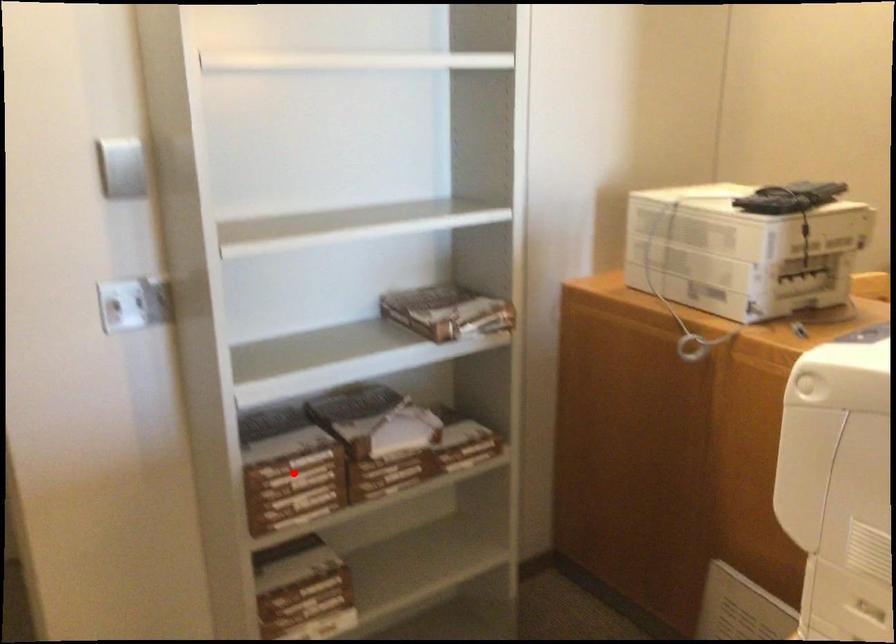
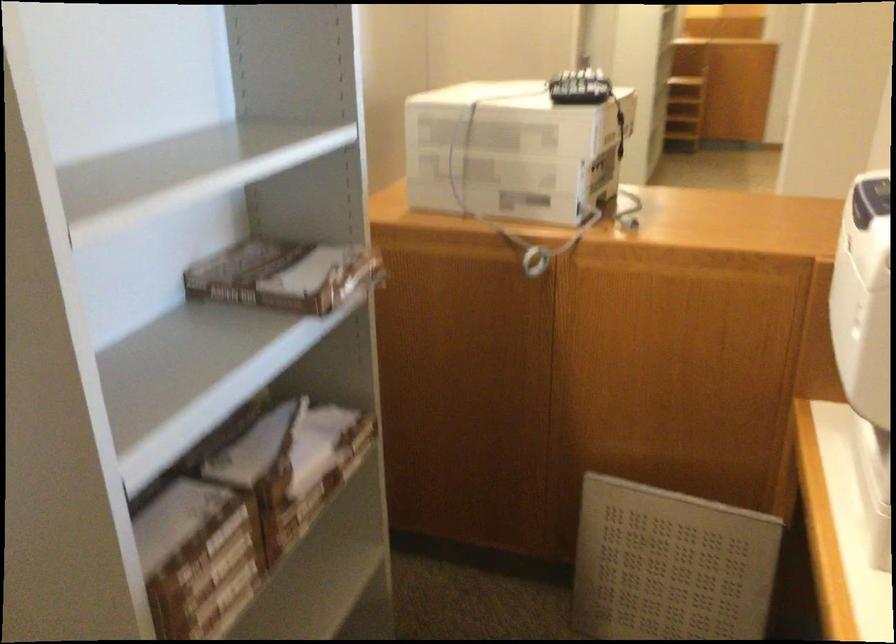
Question: I am providing you with two images of the same scene from different viewpoints. Image1 has a red point marked. In image2, the corresponding 3D location appears at what relative position? Reply with the corresponding letter.

Choices:
 (A) Closer
 (B) Farther

Answer: (A)